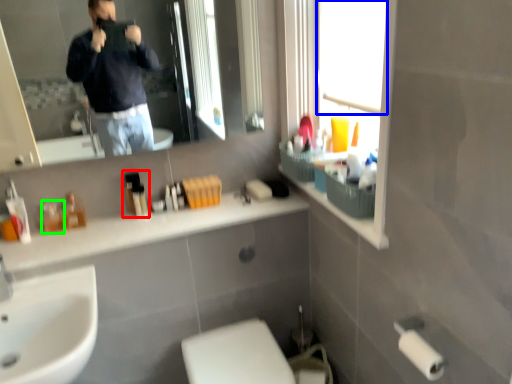
Question: Which is nearer to the toiletry (highlighted by a red box)? window screen (highlighted by a blue box) or toiletry (highlighted by a green box).

Choices:
 (A) window screen
 (B) toiletry

Answer: (B)